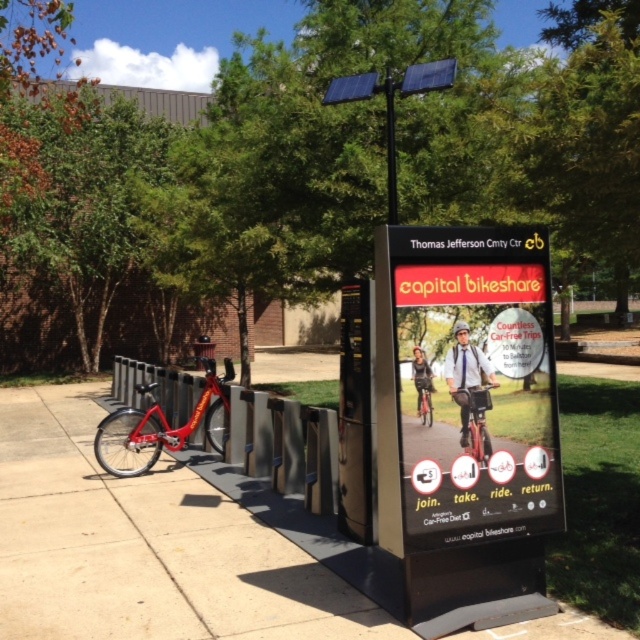
Question: Is metallic sign at center closer to the viewer compared to concrete sidewalk at center?

Choices:
 (A) no
 (B) yes

Answer: (B)

Question: Which point is closer to the camera?

Choices:
 (A) (540, 509)
 (B) (109, 518)

Answer: (A)

Question: Considering the real-world distances, which object is closest to the metallic sign at center?

Choices:
 (A) red matte bicycle at center
 (B) metallic red bike at left
 (C) concrete sidewalk at center

Answer: (A)

Question: From the image, what is the correct spatial relationship of metallic sign at center in relation to metallic red bike at left?

Choices:
 (A) above
 (B) below

Answer: (A)

Question: Which point is closer to the camera?

Choices:
 (A) (481, 419)
 (B) (460, 275)
 (C) (422, 380)
 (D) (134, 388)

Answer: (C)

Question: Does concrete sidewalk at center come in front of metallic red bike at left?

Choices:
 (A) yes
 (B) no

Answer: (A)